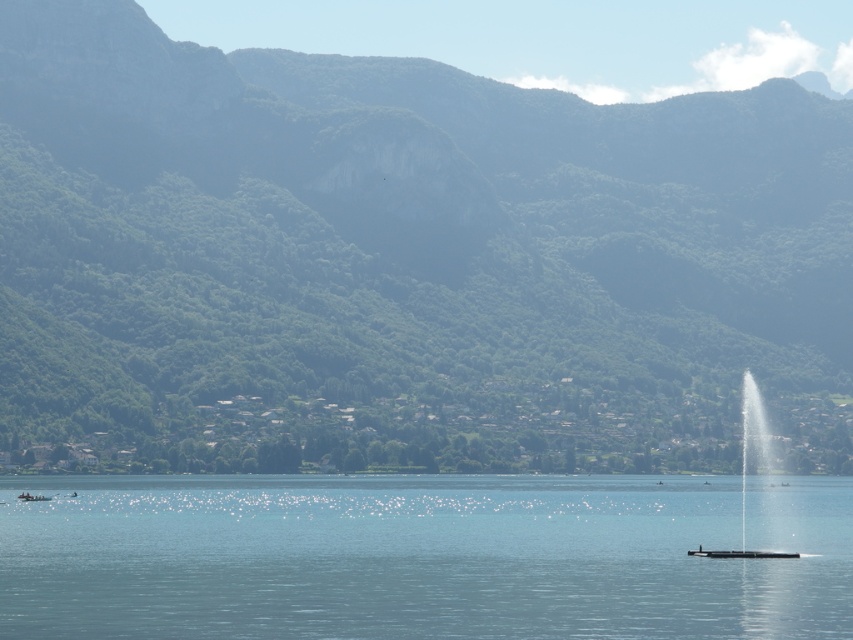
Question: Which point appears closest to the camera in this image?

Choices:
 (A) (27, 497)
 (B) (763, 465)
 (C) (335, 298)

Answer: (C)

Question: Is green forested mountain at center below clear glass fountain at center?

Choices:
 (A) yes
 (B) no

Answer: (B)

Question: Can you confirm if green forested mountain at center is thinner than clear blue water at center?

Choices:
 (A) yes
 (B) no

Answer: (B)

Question: Which of the following is the farthest from the observer?

Choices:
 (A) (496, 266)
 (B) (57, 612)
 (C) (33, 493)

Answer: (B)

Question: Which point is closer to the camera?

Choices:
 (A) clear glass fountain at center
 (B) white plastic boat at lower left

Answer: (A)

Question: From the image, what is the correct spatial relationship of green forested mountain at center in relation to white plastic boat at lower left?

Choices:
 (A) above
 (B) below

Answer: (A)